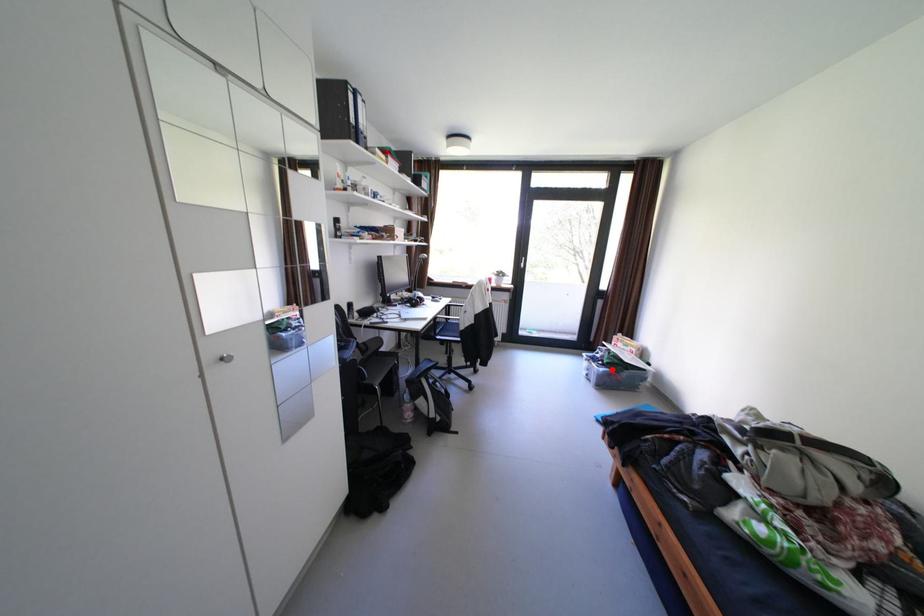
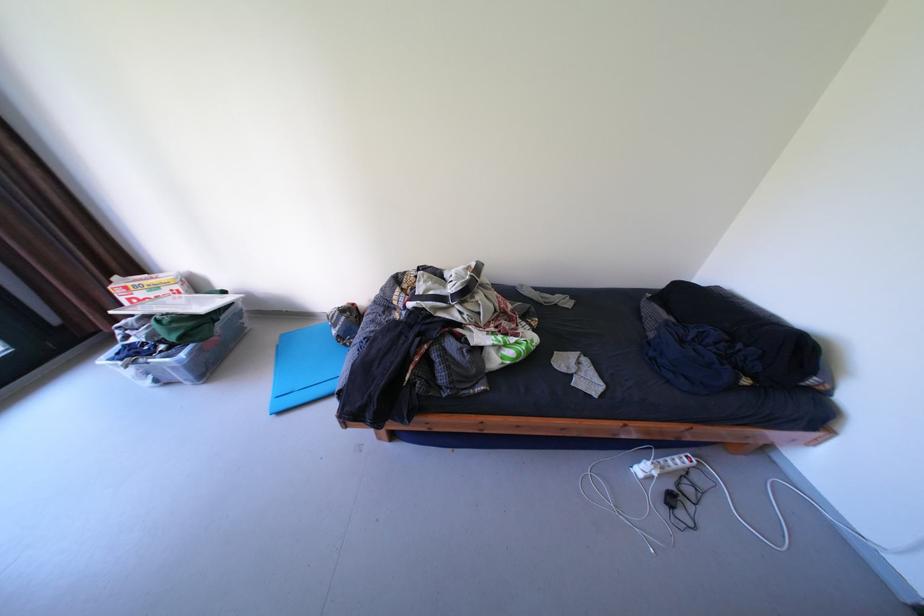
Find the pixel in the second image that matches the highlighted location in the first image.

(193, 355)